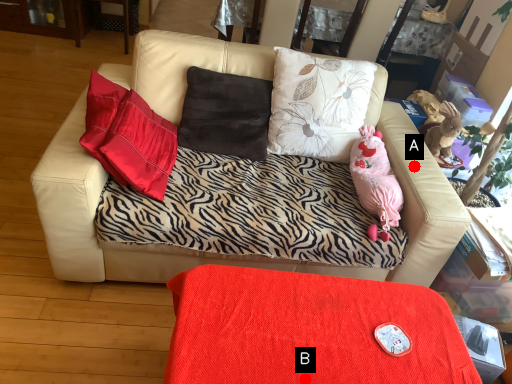
Question: Two points are circled on the image, labeled by A and B beside each circle. Which point is further to the camera?

Choices:
 (A) A is further
 (B) B is further

Answer: (A)